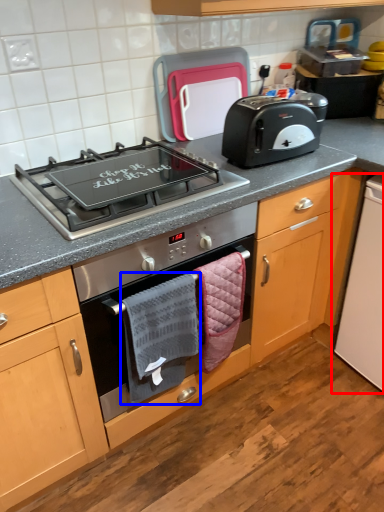
Question: Which object is further to the camera taking this photo, appliance (highlighted by a red box) or hand towel (highlighted by a blue box)?

Choices:
 (A) appliance
 (B) hand towel

Answer: (A)